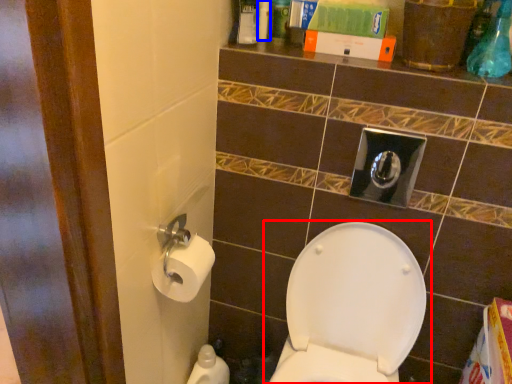
Question: Which of the following is the closest to the observer, toilet (highlighted by a red box) or toiletry (highlighted by a blue box)?

Choices:
 (A) toilet
 (B) toiletry

Answer: (A)